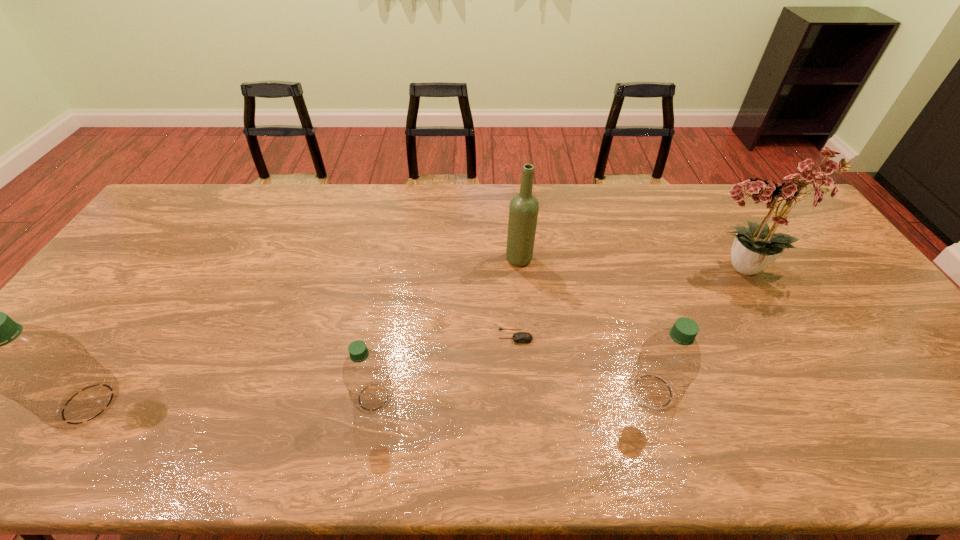
Locate an element on the screen. This screenshot has width=960, height=540. object that is positioned at the near left corner is located at coordinates (48, 372).

This screenshot has width=960, height=540. In the image, there is a desktop. What are the coordinates of `blank space at the far edge` in the screenshot? It's located at (293, 219).

Where is `vacant space at the near edge`? The height and width of the screenshot is (540, 960). vacant space at the near edge is located at coordinates (146, 397).

Where is `vacant point at the far left corner`? This screenshot has height=540, width=960. vacant point at the far left corner is located at coordinates (159, 220).

Find the location of a particular element. The image size is (960, 540). vacant area between the wine bottle and the third farthest object is located at coordinates (517, 297).

Locate an element on the screen. The image size is (960, 540). free space that is in between the second object from right to left and the wine bottle is located at coordinates (587, 325).

Where is `free space between the second object from right to left and the second water bottle from right to left`? The height and width of the screenshot is (540, 960). free space between the second object from right to left and the second water bottle from right to left is located at coordinates (514, 394).

Where is `vacant space that is in between the tallest water bottle and the second water bottle from left to right`? This screenshot has width=960, height=540. vacant space that is in between the tallest water bottle and the second water bottle from left to right is located at coordinates (230, 400).

Find the location of a particular element. vacant area that lies between the fifth object from right to left and the wine bottle is located at coordinates (446, 328).

Locate an element on the screen. Image resolution: width=960 pixels, height=540 pixels. vacant space that's between the mouse and the leftmost water bottle is located at coordinates (301, 370).